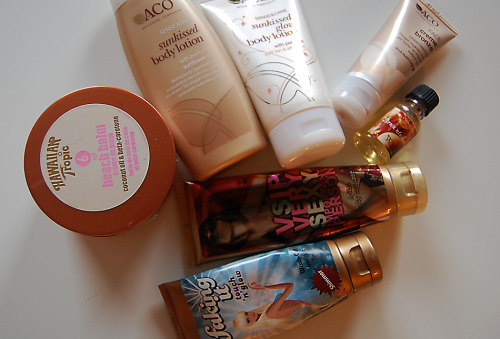
Locate an element on the screen. bottle is located at coordinates (170, 30).